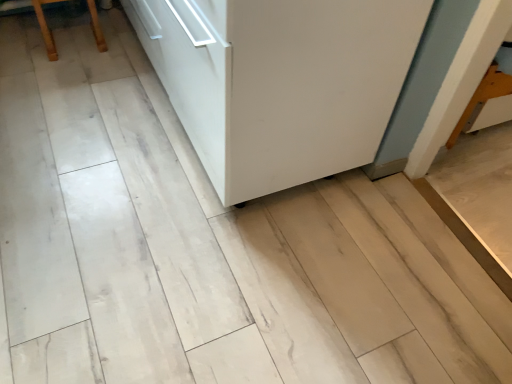
What is the approximate width of wooden chair legs at upper left?

12.27 inches.

Measure the distance between point (49,59) and camera.

The depth of point (49,59) is 2.01 meters.

Find the location of a particular element. The image size is (512, 384). wooden chair legs at upper left is located at coordinates (46, 28).

Image resolution: width=512 pixels, height=384 pixels. What do you see at coordinates (46, 28) in the screenshot?
I see `wooden chair legs at upper left` at bounding box center [46, 28].

This screenshot has width=512, height=384. What are the coordinates of `wooden chair legs at upper left` in the screenshot? It's located at (46, 28).